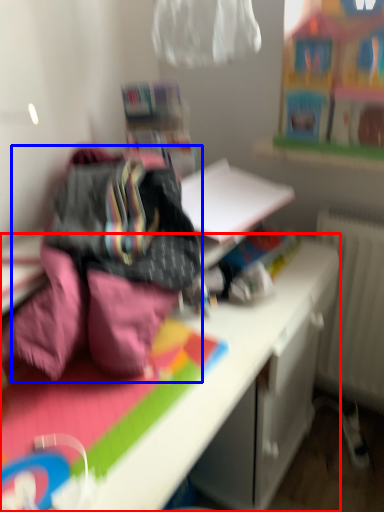
Question: Which of the following is the closest to the observer, desk (highlighted by a red box) or bedding (highlighted by a blue box)?

Choices:
 (A) desk
 (B) bedding

Answer: (A)